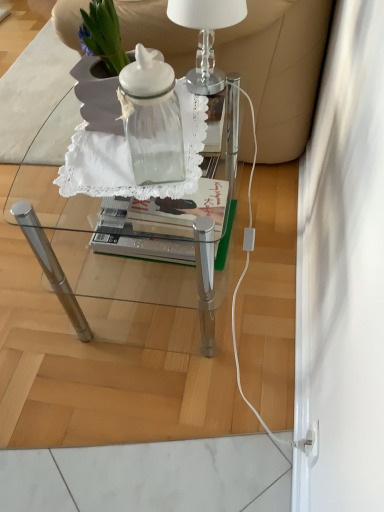
Locate an element on the screen. vacant space situated above transparent glass table at center (from a real-world perspective) is located at coordinates (144, 139).